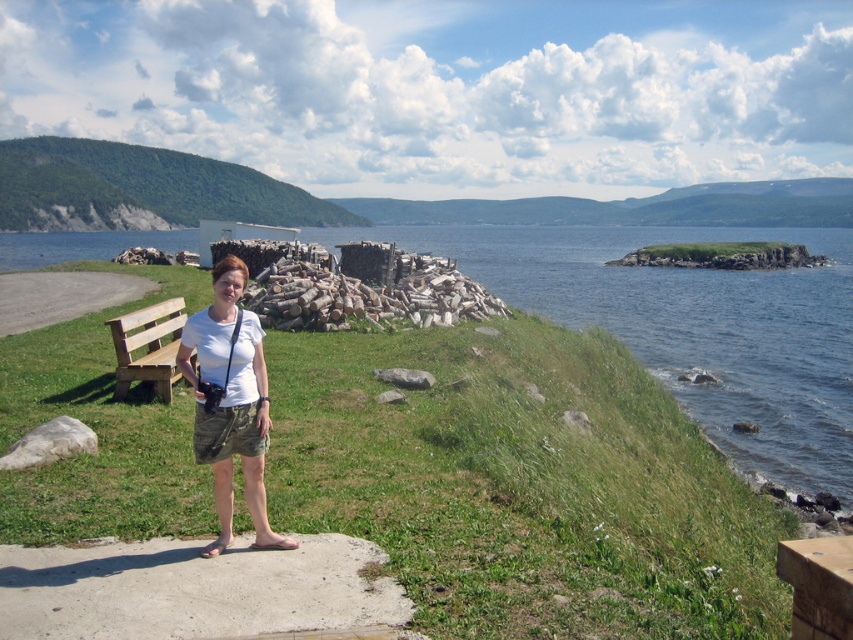
Question: Can you confirm if green leafy hillside at upper left is positioned below white cotton shirt at center?

Choices:
 (A) yes
 (B) no

Answer: (B)

Question: Which object appears farthest from the camera in this image?

Choices:
 (A) white cotton shirt at center
 (B) green grassy at center
 (C) wooden bench at left
 (D) green leafy hillside at upper left

Answer: (D)

Question: Does green leafy hillside at upper left come behind white cotton shirt at center?

Choices:
 (A) yes
 (B) no

Answer: (A)

Question: Can you confirm if white cotton shirt at center is bigger than wooden bench at left?

Choices:
 (A) no
 (B) yes

Answer: (A)

Question: Which of the following is the closest to the observer?

Choices:
 (A) green leafy hillside at upper left
 (B) green grassy at center
 (C) white cotton shirt at center
 (D) wooden bench at left

Answer: (B)

Question: Considering the real-world distances, which object is farthest from the wooden bench at left?

Choices:
 (A) white cotton shirt at center
 (B) green grassy at center
 (C) green leafy hillside at upper left

Answer: (C)